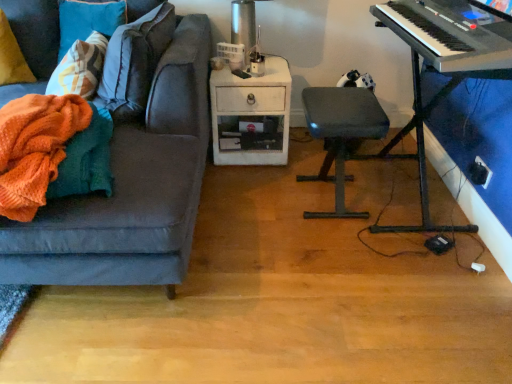
Where is `free point to the right of white wicker side table at center`? This screenshot has height=384, width=512. free point to the right of white wicker side table at center is located at coordinates (304, 153).